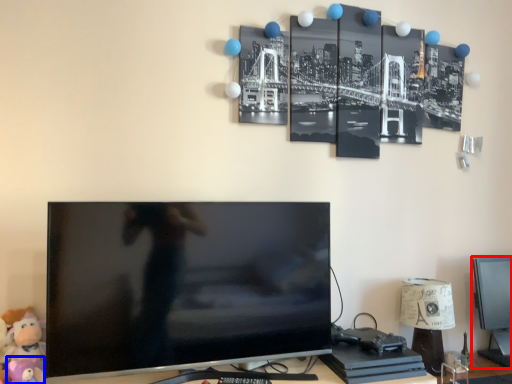
Question: Among these objects, which one is nearest to the camera, computer monitor (highlighted by a red box) or toy (highlighted by a blue box)?

Choices:
 (A) computer monitor
 (B) toy

Answer: (B)